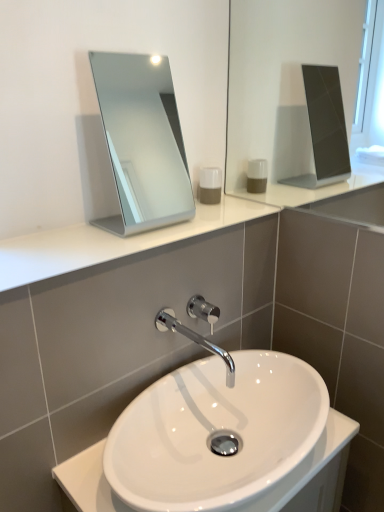
Locate an element on the screen. spots to the right of translucent plastic soap dispenser at center is located at coordinates (244, 205).